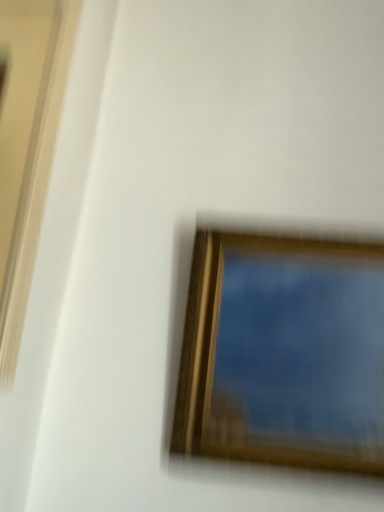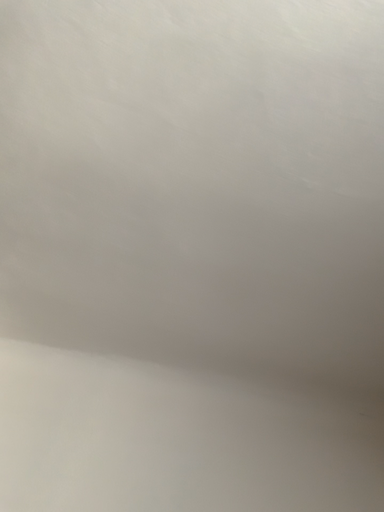
Question: How did the camera likely rotate when shooting the video?

Choices:
 (A) rotated downward
 (B) rotated upward

Answer: (B)